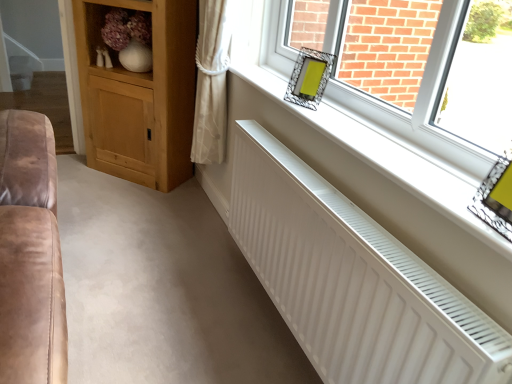
Question: Looking at the image, does metallic silver frame at upper right, arranged as the 2th picture frame when viewed from the left, seem bigger or smaller compared to wooden shelf at upper left?

Choices:
 (A) small
 (B) big

Answer: (A)

Question: In terms of height, does metallic silver frame at upper right, which is counted as the first picture frame, starting from the front, look taller or shorter compared to wooden shelf at upper left?

Choices:
 (A) short
 (B) tall

Answer: (A)

Question: Which of these objects is positioned farthest from the light brown wood cabinet at left?

Choices:
 (A) white matte radiator at lower center
 (B) wooden shelf at upper left
 (C) white ribbed radiator at lower center
 (D) metallic silver frame at upper right, arranged as the 2th picture frame when viewed from the left
 (E) metallic silver picture frame at upper right, positioned as the first picture frame in top-to-bottom order

Answer: (D)

Question: Which of these objects is positioned farthest from the white matte radiator at lower center?

Choices:
 (A) metallic silver picture frame at upper right, the second picture frame positioned from the bottom
 (B) light brown wood cabinet at left
 (C) wooden shelf at upper left
 (D) white ribbed radiator at lower center
 (E) metallic silver frame at upper right, the 2th picture frame viewed from the back

Answer: (C)